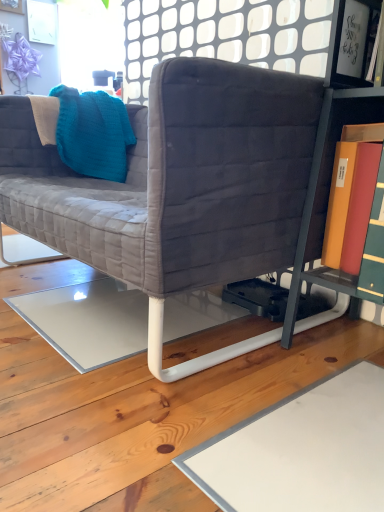
Where is `teal knitted throw pillow at upper left`? The image size is (384, 512). teal knitted throw pillow at upper left is located at coordinates (93, 133).

Identify the location of white glossy frame at upper right. (350, 42).

In order to click on teal knitted throw pillow at upper left in this screenshot , I will do `click(93, 133)`.

Can you confirm if white glossy frame at upper right is shorter than teal knitted throw pillow at upper left?

Yes.

Is white glossy frame at upper right located outside teal knitted throw pillow at upper left?

white glossy frame at upper right is positioned outside teal knitted throw pillow at upper left.

Looking at the image, does white glossy frame at upper right seem bigger or smaller compared to teal knitted throw pillow at upper left?

Clearly, white glossy frame at upper right is smaller in size than teal knitted throw pillow at upper left.

Locate an element on the screen. The width and height of the screenshot is (384, 512). throw pillow above the velvet gray couch at center (from a real-world perspective) is located at coordinates (93, 133).

Are velvet gray couch at center and teal knitted throw pillow at upper left located far from each other?

Actually, velvet gray couch at center and teal knitted throw pillow at upper left are a little close together.

Which is closer to the camera, (2, 217) or (83, 97)?

Point (2, 217) is closer to the camera than point (83, 97).

Which of these two, velvet gray couch at center or teal knitted throw pillow at upper left, is wider?

velvet gray couch at center.

Does velvet gray couch at center have a lesser height compared to white glossy frame at upper right?

No, velvet gray couch at center is not shorter than white glossy frame at upper right.

Is velvet gray couch at center positioned with its back to white glossy frame at upper right?

No, velvet gray couch at center's orientation is not away from white glossy frame at upper right.

Considering the points (118, 186) and (358, 24), which point is in front, point (118, 186) or point (358, 24)?

Point (358, 24)

Can we say velvet gray couch at center lies outside white glossy frame at upper right?

Absolutely, velvet gray couch at center is external to white glossy frame at upper right.

From the image's perspective, is white glossy frame at upper right above or below velvet gray couch at center?

white glossy frame at upper right is situated higher than velvet gray couch at center in the image.

How many degrees apart are the facing directions of white glossy frame at upper right and velvet gray couch at center?

0.626 degrees.

Is point (348, 30) closer to viewer compared to point (321, 93)?

No.

Looking at this image, measure the distance from white glossy frame at upper right to velvet gray couch at center.

white glossy frame at upper right is 21.05 inches away from velvet gray couch at center.

In the image, is teal knitted throw pillow at upper left on the left side or the right side of velvet gray couch at center?

In the image, teal knitted throw pillow at upper left appears on the left side of velvet gray couch at center.

From the image's perspective, relative to velvet gray couch at center, is teal knitted throw pillow at upper left above or below?

teal knitted throw pillow at upper left is situated higher than velvet gray couch at center in the image.

Is teal knitted throw pillow at upper left placed right next to velvet gray couch at center?

No, teal knitted throw pillow at upper left is not making contact with velvet gray couch at center.

Considering the points (122, 134) and (37, 234), which point is behind, point (122, 134) or point (37, 234)?

Point (122, 134)

The image size is (384, 512). In the image, there is a white glossy frame at upper right. In order to click on throw pillow above it (from the image's perspective) in this screenshot , I will do `click(93, 133)`.

Would you say white glossy frame at upper right is part of teal knitted throw pillow at upper left's contents?

No.

Looking at this image, from the image's perspective, which object appears higher, teal knitted throw pillow at upper left or white glossy frame at upper right?

teal knitted throw pillow at upper left.

How far apart are teal knitted throw pillow at upper left and white glossy frame at upper right?

1.11 meters.

In order to click on throw pillow behind the white glossy frame at upper right in this screenshot , I will do `click(93, 133)`.

Where is `throw pillow that is above the velvet gray couch at center (from the image's perspective)`? throw pillow that is above the velvet gray couch at center (from the image's perspective) is located at coordinates (93, 133).

Which object lies further to the anchor point white glossy frame at upper right, teal knitted throw pillow at upper left or velvet gray couch at center?

teal knitted throw pillow at upper left is further to white glossy frame at upper right.

In the scene shown: When comparing their distances from white glossy frame at upper right, does velvet gray couch at center or teal knitted throw pillow at upper left seem further?

teal knitted throw pillow at upper left is further to white glossy frame at upper right.

Considering their positions, is white glossy frame at upper right positioned further to velvet gray couch at center than teal knitted throw pillow at upper left?

white glossy frame at upper right.

When comparing their distances from teal knitted throw pillow at upper left, does velvet gray couch at center or white glossy frame at upper right seem closer?

velvet gray couch at center is positioned closer to the anchor teal knitted throw pillow at upper left.

Which object lies further to the anchor point teal knitted throw pillow at upper left, white glossy frame at upper right or velvet gray couch at center?

Among the two, white glossy frame at upper right is located further to teal knitted throw pillow at upper left.

Based on their spatial positions, is teal knitted throw pillow at upper left or white glossy frame at upper right closer to velvet gray couch at center?

teal knitted throw pillow at upper left.

The image size is (384, 512). Find the location of `shelf between velvet gray couch at center and teal knitted throw pillow at upper left along the z-axis`. shelf between velvet gray couch at center and teal knitted throw pillow at upper left along the z-axis is located at coordinates (350, 42).